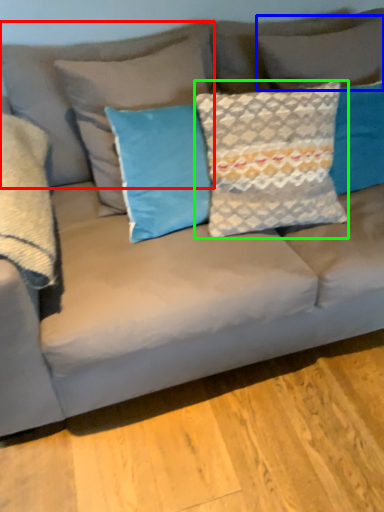
Question: Which is farther away from pillow (highlighted by a red box)? pillow (highlighted by a blue box) or pillow (highlighted by a green box)?

Choices:
 (A) pillow
 (B) pillow

Answer: (B)